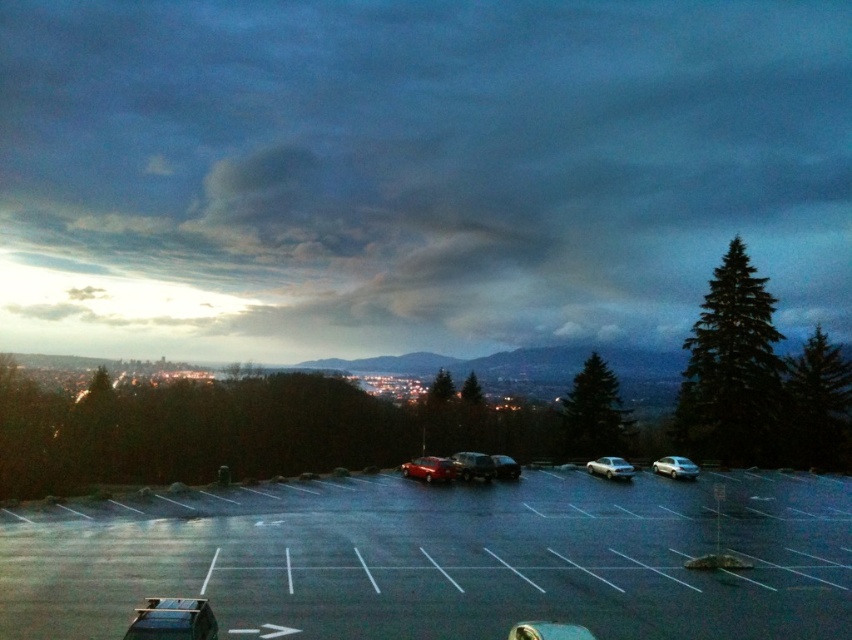
Looking at this image, you are driving a car and want to park in the smooth asphalt parking lot at lower center. The satin silver sedan at center is currently blocking the entrance. Can you drive around the sedan to access the parking lot?

The smooth asphalt parking lot at lower center is shorter than the satin silver sedan at center, so the sedan is taller than the parking lot. This means the sedan is blocking the entrance, and you cannot drive around it to access the parking lot.